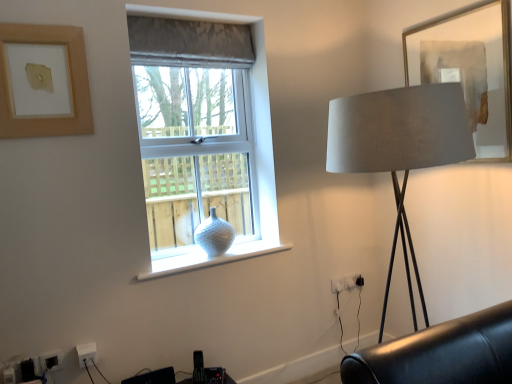
The width and height of the screenshot is (512, 384). Identify the location of free location above matte silver picture frame at upper right, marked as the first picture frame in a right-to-left arrangement (from a real-world perspective). coord(451,11).